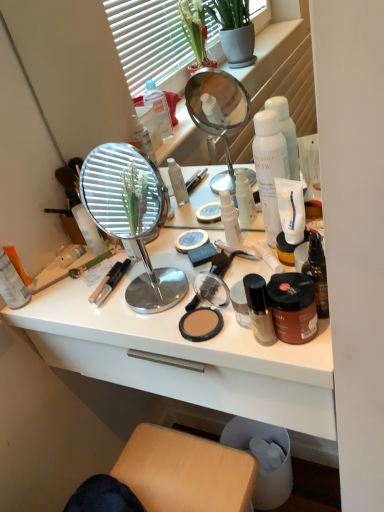
This screenshot has height=512, width=384. I want to click on free space that is in between orange matte lotion at left, the 5th toiletry positioned from the right, and brown matte jar at center-right, the fourth toiletry positioned from the left, so click(113, 313).